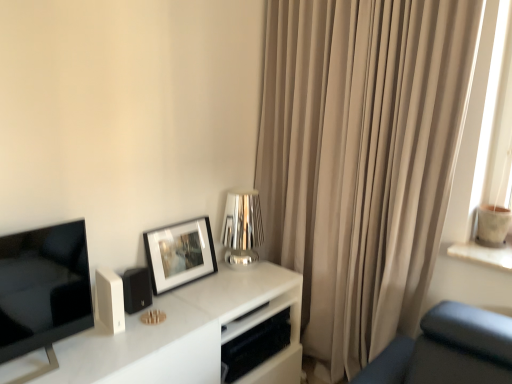
Question: Is white plastic speaker at lower left to the left or to the right of matte black speaker at lower left in the image?

Choices:
 (A) right
 (B) left

Answer: (B)

Question: Which is correct: white plastic speaker at lower left is inside matte black speaker at lower left, or outside of it?

Choices:
 (A) outside
 (B) inside

Answer: (A)

Question: Considering the real-world distances, which object is farthest from the shiny metallic table lamp at center?

Choices:
 (A) white plastic speaker at lower left
 (B) beige fabric curtain at right
 (C) matte black picture frame at center left
 (D) black glossy television at left
 (E) matte black speaker at lower left

Answer: (D)

Question: Estimate the real-world distances between objects in this image. Which object is farther from the shiny metallic table lamp at center?

Choices:
 (A) white marble tv stand at center
 (B) black glossy television at left
 (C) matte black picture frame at center left
 (D) matte black speaker at lower left
 (E) white plastic speaker at lower left

Answer: (B)